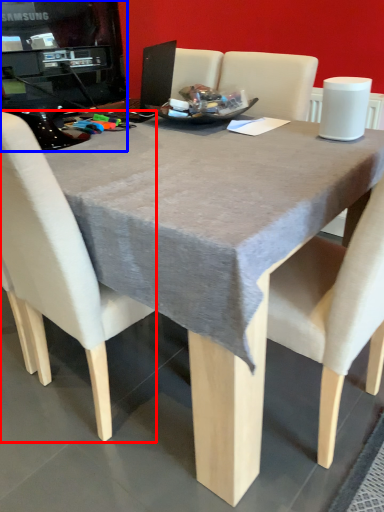
Question: Which point is closer to the camera, chair (highlighted by a red box) or desktop computer (highlighted by a blue box)?

Choices:
 (A) chair
 (B) desktop computer

Answer: (A)